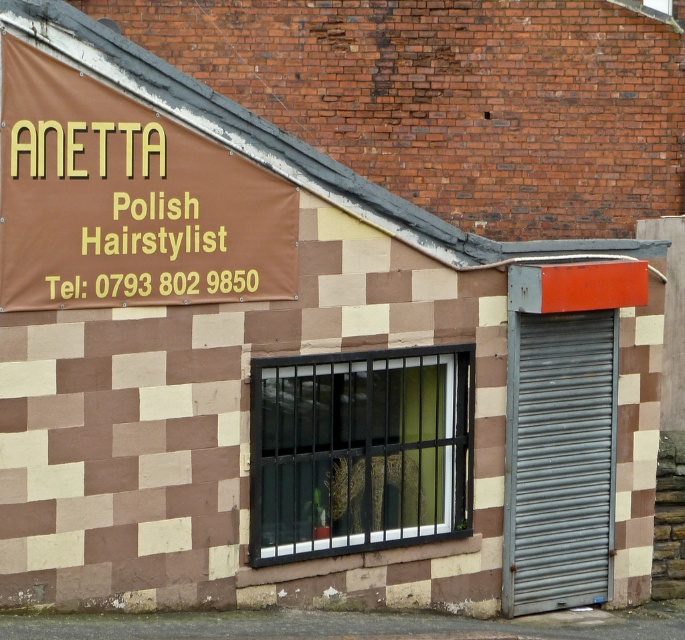
You are standing in front of the building and want to locate the telephone number displayed on the signboard. According to the image, where exactly is the telephone number located relative to the point at coordinates point (127, 200)?

The telephone number is located to the right of the point at coordinates point (127, 200) because the brown vinyl banner at upper left contains the text

You are a delivery person trying to attach a parcel to the building. The parcel is 2 meters wide. You have two options to place it either on the brown vinyl banner at upper left or on the gray metallic shutter at right. Which location can accommodate the parcel based on width?

The brown vinyl banner at upper left might be wider than gray metallic shutter at right, so it is more likely to accommodate the 2 meter wide parcel.

You are standing in front of the building and want to locate the brown vinyl banner at upper left. According to the coordinates given, where should you look relative to the signboard?

The brown vinyl banner at upper left is located at coordinates point (127, 200), which is to the upper left relative to the signboard.